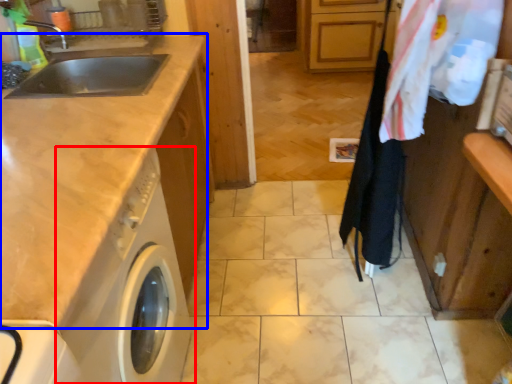
Question: Which object appears farthest to the camera in this image, washing machine (highlighted by a red box) or countertop (highlighted by a blue box)?

Choices:
 (A) washing machine
 (B) countertop

Answer: (B)